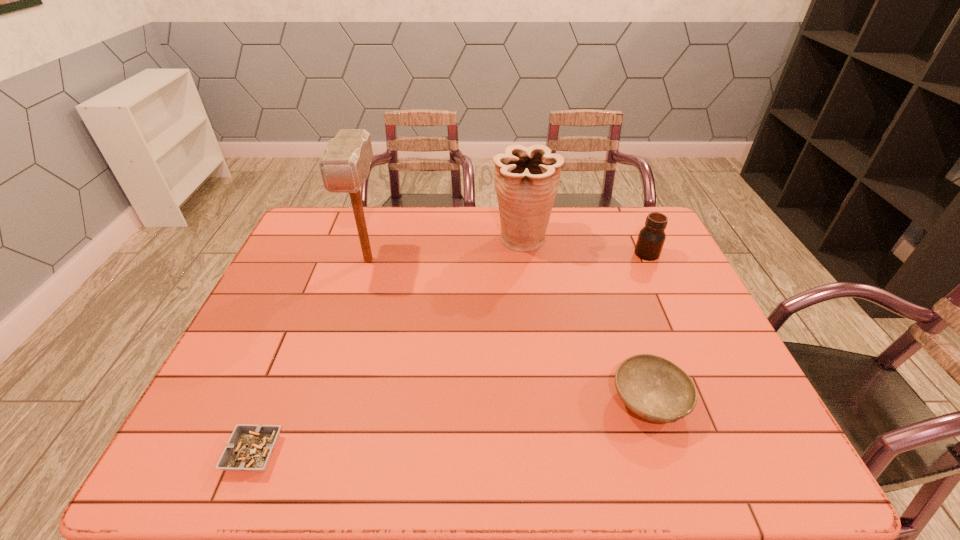
Locate an element on the screen. The height and width of the screenshot is (540, 960). mallet is located at coordinates (345, 165).

Identify the location of the second object from left to right. (345, 165).

Image resolution: width=960 pixels, height=540 pixels. What are the coordinates of `urn` in the screenshot? It's located at (526, 181).

I want to click on the third object from right to left, so click(x=526, y=181).

The image size is (960, 540). Identify the location of the rightmost object. (651, 238).

Identify the location of jar. The image size is (960, 540). (651, 238).

Find the location of a particular element. This screenshot has width=960, height=540. the second object from right to left is located at coordinates (654, 388).

The width and height of the screenshot is (960, 540). I want to click on the fourth tallest object, so click(654, 388).

The image size is (960, 540). I want to click on the shortest object, so click(250, 447).

Where is `ashtray`? This screenshot has height=540, width=960. ashtray is located at coordinates (250, 447).